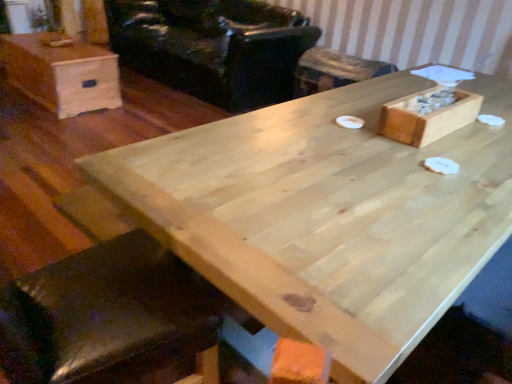
Find the location of a particular element. free space to the right of wooden box at upper right is located at coordinates (487, 132).